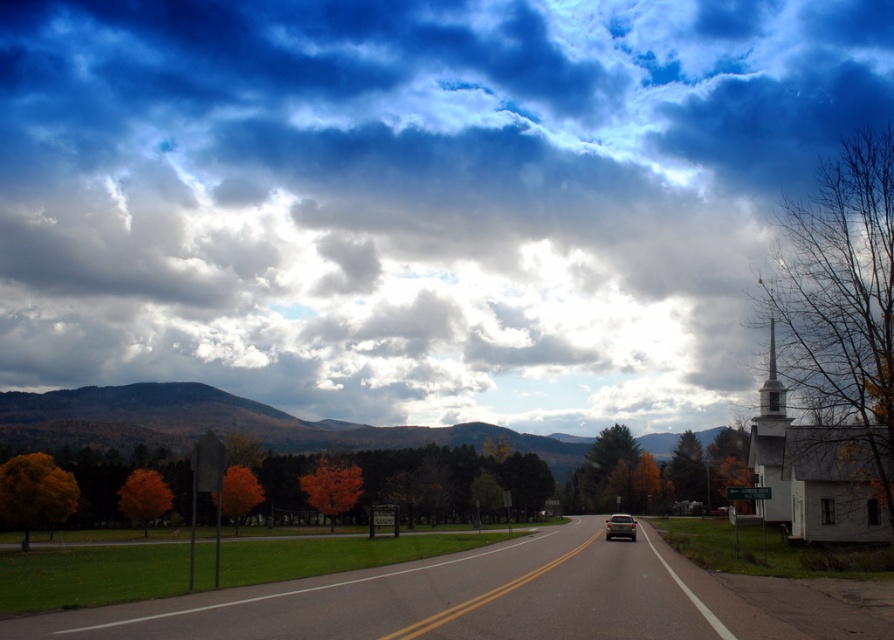
Between golden-brown foliage at left and green textured pine tree at right, which one is positioned lower?

green textured pine tree at right

Can you confirm if golden-brown foliage at left is bigger than green textured pine tree at right?

Incorrect, golden-brown foliage at left is not larger than green textured pine tree at right.

The image size is (894, 640). I want to click on golden-brown foliage at left, so click(34, 493).

Where is `golden-brown foliage at left`? golden-brown foliage at left is located at coordinates point(34,493).

Is golden-brown foliage at left bigger than orange matte tree at center?

Correct, golden-brown foliage at left is larger in size than orange matte tree at center.

Does golden-brown foliage at left lie behind orange matte tree at center?

No, it is in front of orange matte tree at center.

The image size is (894, 640). Find the location of `golden-brown foliage at left`. golden-brown foliage at left is located at coordinates (34, 493).

Who is more distant from viewer, (148, 500) or (770, 413)?

Point (148, 500)

The height and width of the screenshot is (640, 894). Describe the element at coordinates (142, 497) in the screenshot. I see `orange matte tree at lower left` at that location.

Where is `orange matte tree at lower left`? The image size is (894, 640). orange matte tree at lower left is located at coordinates (142, 497).